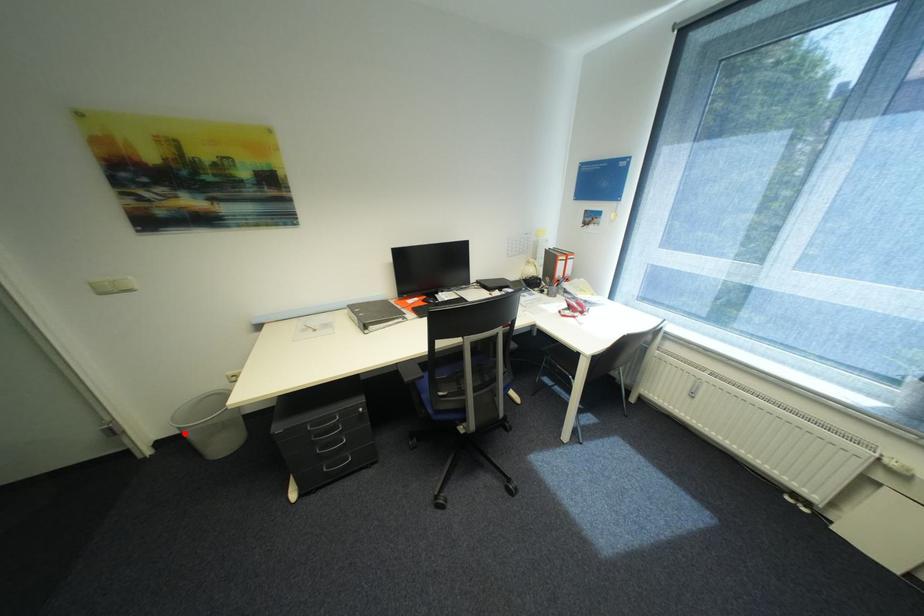
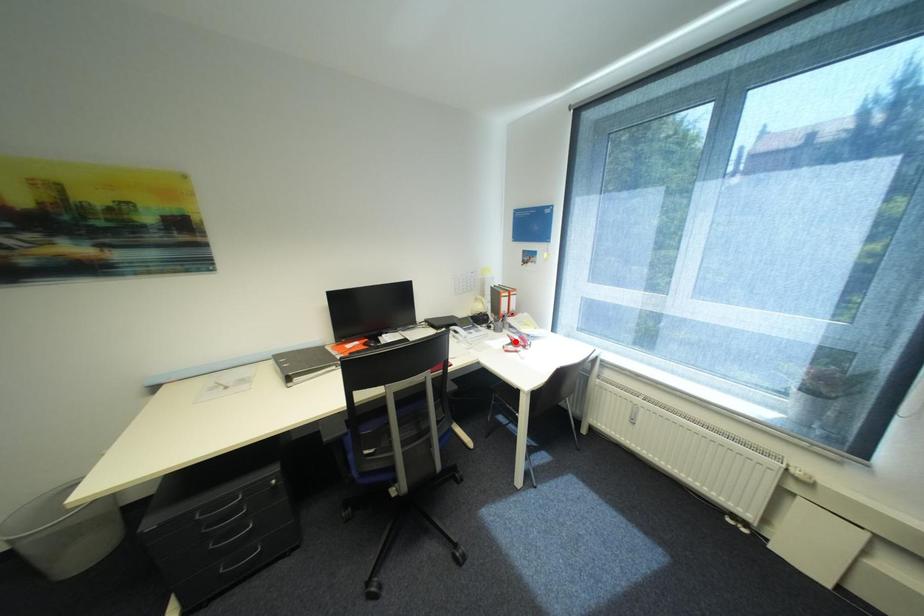
I am providing you with two images of the same scene from different viewpoints. A red point is marked on the first image and another point is marked on the second image. Is the marked point in image1 the same physical position as the marked point in image2?

No